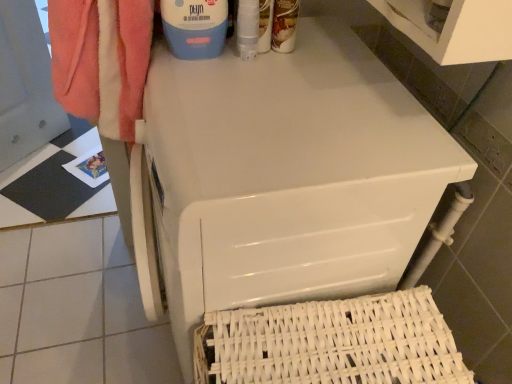
Question: Is matte brown bottle at upper center, the second cleaning product viewed from the left, not near white glossy washing machine at upper center?

Choices:
 (A) no
 (B) yes

Answer: (A)

Question: Is matte brown bottle at upper center, the 1th cleaning product positioned from the right, oriented away from white glossy washing machine at upper center?

Choices:
 (A) yes
 (B) no

Answer: (B)

Question: From a real-world perspective, is matte brown bottle at upper center, the second cleaning product viewed from the left, on top of white glossy washing machine at upper center?

Choices:
 (A) no
 (B) yes

Answer: (B)

Question: Considering the relative sizes of matte brown bottle at upper center, the 1th cleaning product positioned from the right, and white glossy washing machine at upper center in the image provided, is matte brown bottle at upper center, the 1th cleaning product positioned from the right, taller than white glossy washing machine at upper center?

Choices:
 (A) yes
 (B) no

Answer: (B)

Question: Is matte brown bottle at upper center, the 1th cleaning product positioned from the right, closer to the viewer compared to white glossy washing machine at upper center?

Choices:
 (A) no
 (B) yes

Answer: (A)

Question: Is matte brown bottle at upper center, the 1th cleaning product positioned from the right, inside or outside of white glossy washing machine at upper center?

Choices:
 (A) outside
 (B) inside

Answer: (A)

Question: Based on their positions, is matte brown bottle at upper center, the second cleaning product viewed from the left, located to the left or right of white glossy washing machine at upper center?

Choices:
 (A) left
 (B) right

Answer: (B)

Question: Is point (287, 24) closer or farther from the camera than point (198, 253)?

Choices:
 (A) farther
 (B) closer

Answer: (A)

Question: From a real-world perspective, is matte brown bottle at upper center, the 1th cleaning product positioned from the right, physically located above or below white glossy washing machine at upper center?

Choices:
 (A) below
 (B) above

Answer: (B)

Question: Considering their positions, is matte brown bottle at upper center, the second cleaning product viewed from the left, located in front of or behind blue plastic container at upper center, which is counted as the 1th cleaning product, starting from the left?

Choices:
 (A) behind
 (B) front

Answer: (A)

Question: From the image's perspective, is matte brown bottle at upper center, the second cleaning product viewed from the left, above or below blue plastic container at upper center, which is counted as the 1th cleaning product, starting from the left?

Choices:
 (A) below
 (B) above

Answer: (A)

Question: Does point (288, 8) appear closer or farther from the camera than point (221, 31)?

Choices:
 (A) closer
 (B) farther

Answer: (B)

Question: In terms of width, does matte brown bottle at upper center, the 1th cleaning product positioned from the right, look wider or thinner when compared to blue plastic container at upper center, which is counted as the 1th cleaning product, starting from the left?

Choices:
 (A) wide
 (B) thin

Answer: (B)

Question: From the image's perspective, is white woven basket at lower right located above or below white glossy washing machine at upper center?

Choices:
 (A) below
 (B) above

Answer: (A)

Question: Based on their sizes in the image, would you say white woven basket at lower right is bigger or smaller than white glossy washing machine at upper center?

Choices:
 (A) big
 (B) small

Answer: (B)